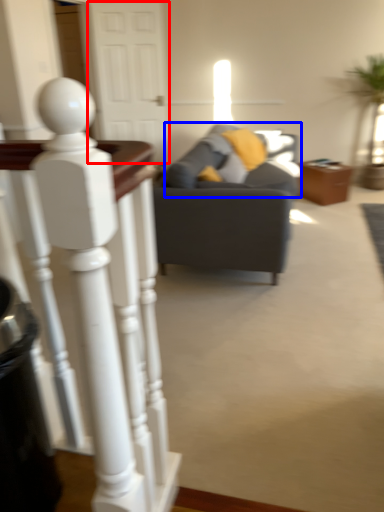
Question: Which object is closer to the camera taking this photo, glass door (highlighted by a red box) or swivel chair (highlighted by a blue box)?

Choices:
 (A) glass door
 (B) swivel chair

Answer: (B)